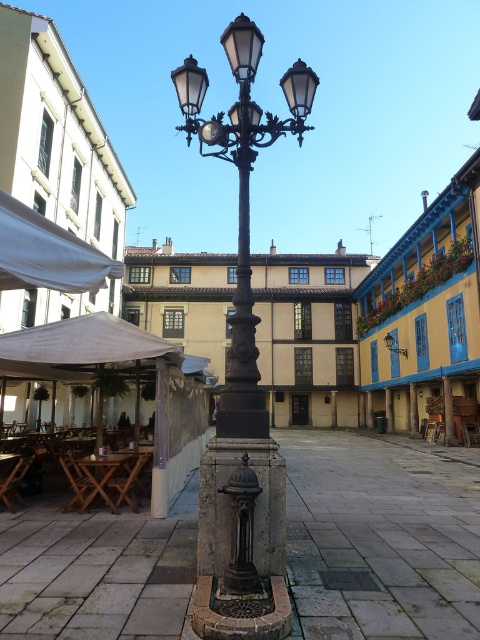
Is white fabric canopy at upper left smaller than metallic wall-mounted light at upper right?

No, white fabric canopy at upper left is not smaller than metallic wall-mounted light at upper right.

Does white fabric canopy at upper left have a greater width compared to metallic wall-mounted light at upper right?

In fact, white fabric canopy at upper left might be narrower than metallic wall-mounted light at upper right.

Which is behind, point (75, 256) or point (389, 337)?

The point (389, 337) is more distant.

Where is `white fabric canopy at upper left`? This screenshot has height=640, width=480. white fabric canopy at upper left is located at coordinates (48, 253).

Is polished bronze streetlamp at center wider than white fabric canopy at upper left?

Indeed, polished bronze streetlamp at center has a greater width compared to white fabric canopy at upper left.

Is point (286, 627) positioned in front of point (95, 291)?

Yes, point (286, 627) is in front of point (95, 291).

Who is more distant from viewer, (222,145) or (81,259)?

Positioned behind is point (222,145).

Locate an element on the screen. The height and width of the screenshot is (640, 480). polished bronze streetlamp at center is located at coordinates (241, 378).

Who is positioned more to the left, polished bronze streetlamp at center or metallic wall-mounted light at upper right?

Positioned to the left is polished bronze streetlamp at center.

The image size is (480, 640). In order to click on polished bronze streetlamp at center in this screenshot , I will do `click(241, 378)`.